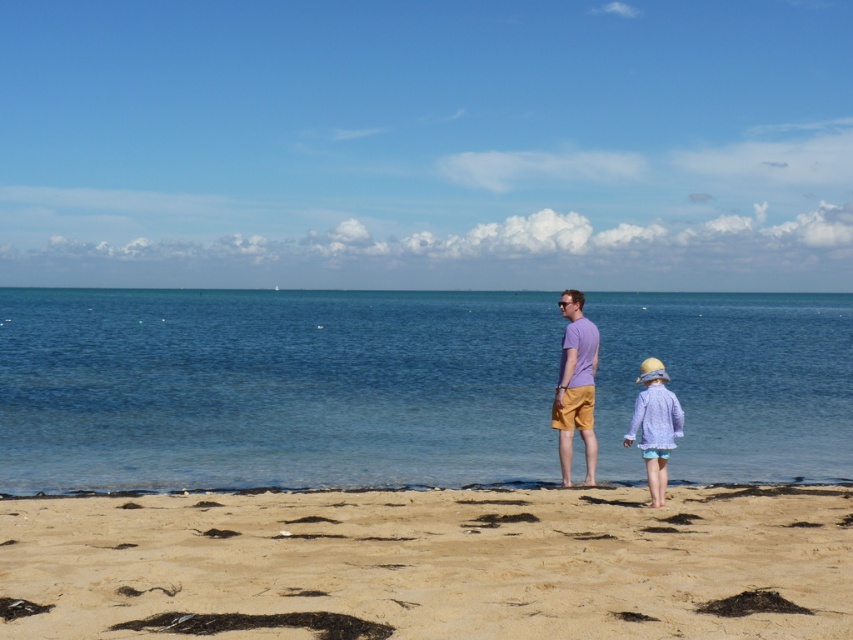
You are a photographer trying to capture the scene of the purple cotton shirt at center and the light purple cotton dress at lower right. Which clothing item is positioned higher in the image?

The purple cotton shirt at center is positioned higher in the image than the light purple cotton dress at lower right.

You are planning to take a photo of the clear blue water at center and the purple cotton shirt at center. Which object is wider in the image?

The clear blue water at center might be wider than purple cotton shirt at center according to the description.